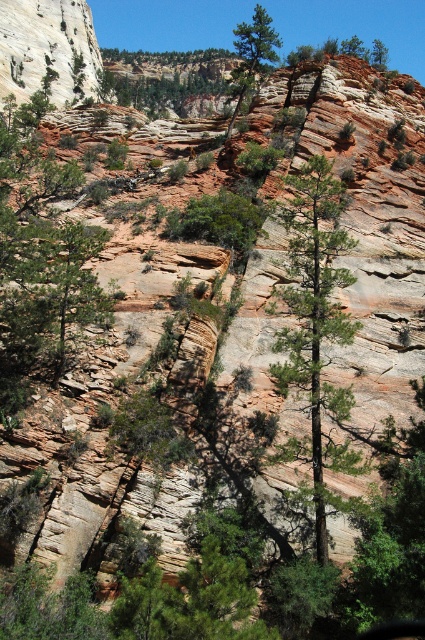
You are a hiker trying to navigate through the rocky terrain. You see the green matte tree at center and the green leafy tree at upper center. Which tree is positioned higher up in the landscape?

The green leafy tree at upper center is positioned higher up in the landscape than the green matte tree at center.